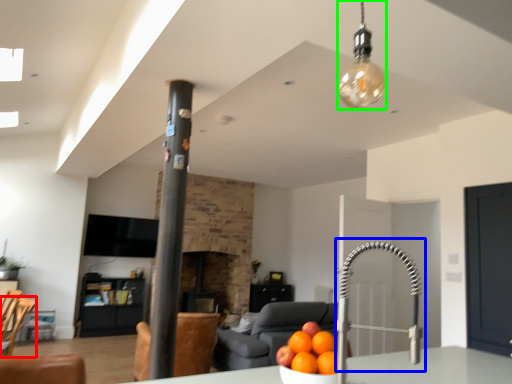
Question: Considering the real-world distances, which object is farthest from swivel chair (highlighted by a red box)? faucet (highlighted by a blue box) or light fixture (highlighted by a green box)?

Choices:
 (A) faucet
 (B) light fixture

Answer: (B)